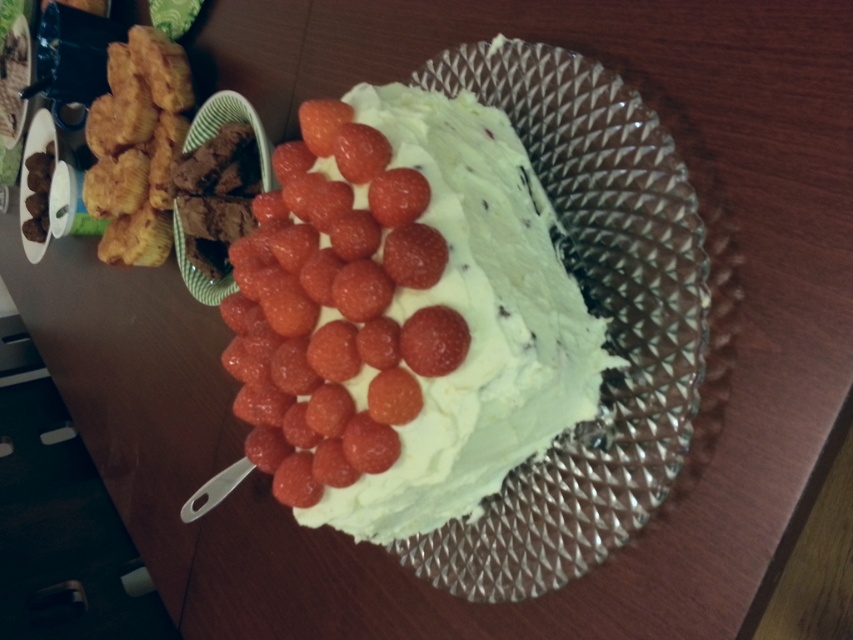
Based on the photo, which of these two, clear glass plate at center or white creamy cake at center, stands taller?

Standing taller between the two is clear glass plate at center.

Is clear glass plate at center smaller than white creamy cake at center?

Incorrect, clear glass plate at center is not smaller in size than white creamy cake at center.

This screenshot has width=853, height=640. Find the location of `clear glass plate at center`. clear glass plate at center is located at coordinates (590, 312).

Identify the location of clear glass plate at center. This screenshot has height=640, width=853. point(590,312).

Can you confirm if clear glass plate at center is bigger than golden fried chicken at left?

Correct, clear glass plate at center is larger in size than golden fried chicken at left.

Is clear glass plate at center shorter than golden fried chicken at left?

No.

At what (x,y) coordinates should I click in order to perform the action: click on clear glass plate at center. Please return your answer as a coordinate pair (x, y). Looking at the image, I should click on (590, 312).

Measure the distance from white creamy cake at center to golden fried chicken at left.

The distance of white creamy cake at center from golden fried chicken at left is 3.31 feet.

Is white creamy cake at center closer to the viewer compared to golden fried chicken at left?

That is True.

Who is more distant from viewer, (549,348) or (131,109)?

Positioned behind is point (131,109).

I want to click on white creamy cake at center, so click(474, 321).